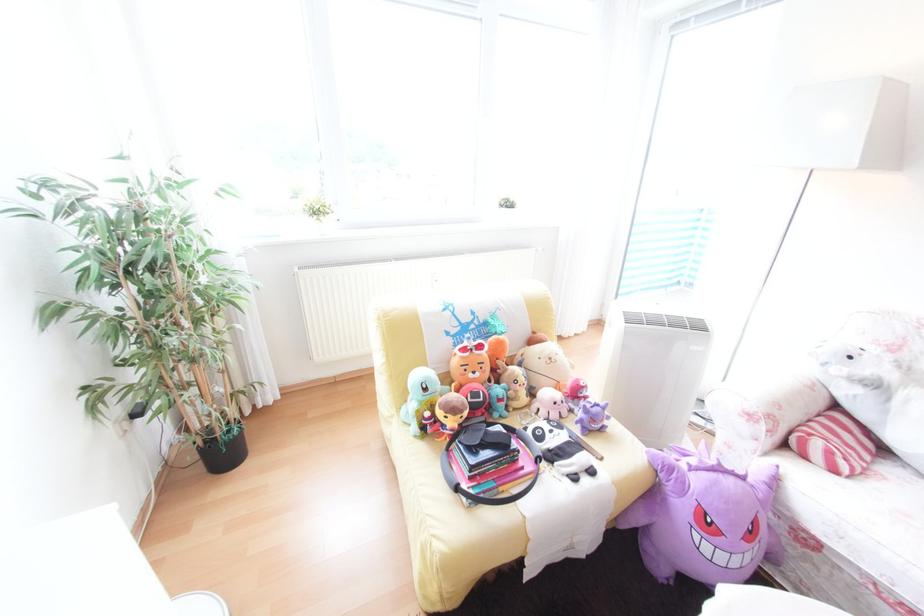
Where is `panda plush toy`? panda plush toy is located at coordinates (565, 448).